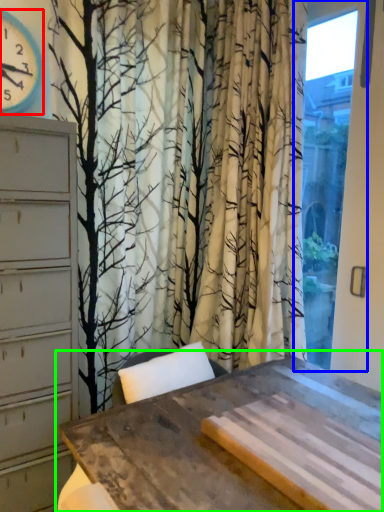
Question: Which object is positioned closest to clock (highlighted by a red box)? Select from window (highlighted by a blue box) and table (highlighted by a green box).

Choices:
 (A) window
 (B) table

Answer: (A)